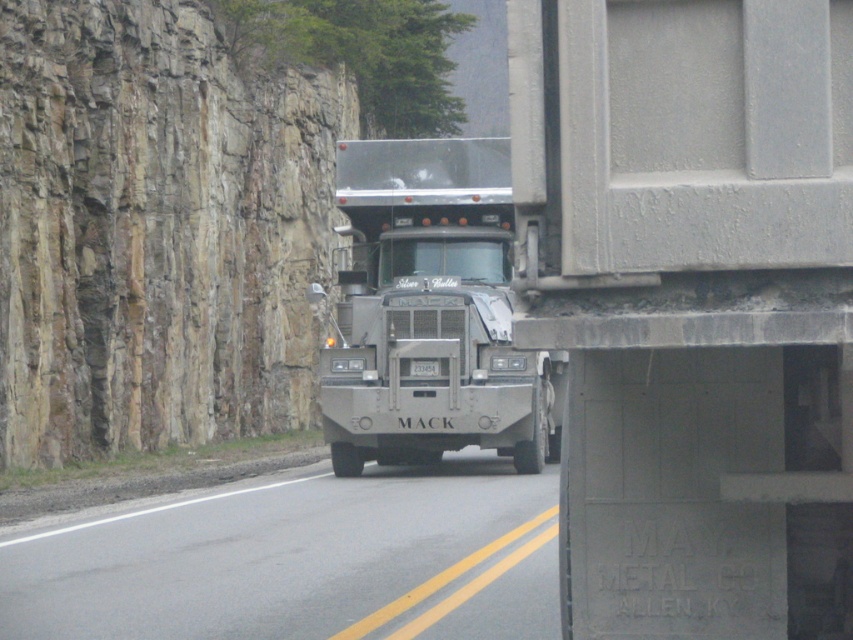
Is gray concrete trailer truck at right in front of gray asphalt road at center?

Yes, it is in front of gray asphalt road at center.

Is gray concrete trailer truck at right below gray asphalt road at center?

No, gray concrete trailer truck at right is not below gray asphalt road at center.

Between point (596, 97) and point (74, 596), which one is positioned in front?

Point (596, 97) is in front.

Find the location of a particular element. The width and height of the screenshot is (853, 640). gray concrete trailer truck at right is located at coordinates (692, 305).

How distant is gray asphalt road at center from matte gray truck at center?

gray asphalt road at center is 8.02 meters away from matte gray truck at center.

Who is taller, gray asphalt road at center or matte gray truck at center?

With more height is gray asphalt road at center.

Who is more forward, (440,467) or (410,296)?

Positioned in front is point (410,296).

Find the location of a particular element. The image size is (853, 640). gray asphalt road at center is located at coordinates (299, 560).

Looking at this image, measure the distance between gray concrete trailer truck at right and camera.

gray concrete trailer truck at right is 4.18 meters from camera.

Is point (595, 173) in front of point (503, 141)?

That is True.

Where is `gray concrete trailer truck at right`? The width and height of the screenshot is (853, 640). gray concrete trailer truck at right is located at coordinates (692, 305).